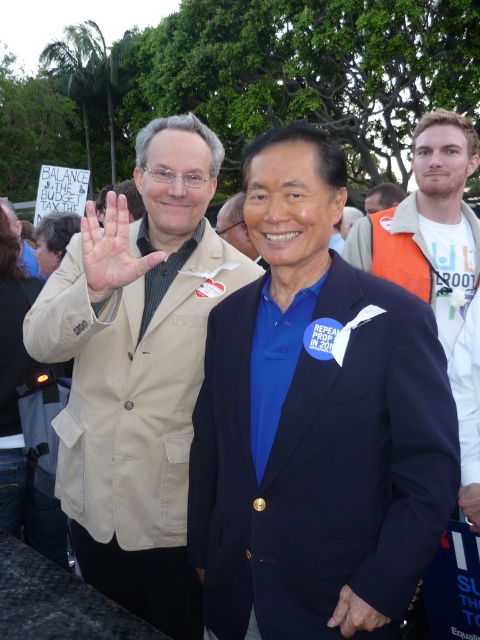
Can you confirm if matte black hair at lower left is positioned below matte black jacket at center?

Yes.

Where is `matte black hair at lower left`? The height and width of the screenshot is (640, 480). matte black hair at lower left is located at coordinates (54, 240).

Find the location of a particular element. The height and width of the screenshot is (640, 480). matte black hair at lower left is located at coordinates (54, 240).

Locate an element on the screen. The width and height of the screenshot is (480, 640). matte black hair at lower left is located at coordinates (54, 240).

Is navy wool blazer at center wider than matte black hair at lower left?

Correct, the width of navy wool blazer at center exceeds that of matte black hair at lower left.

Can you confirm if navy wool blazer at center is smaller than matte black hair at lower left?

No, navy wool blazer at center is not smaller than matte black hair at lower left.

At what (x,y) coordinates should I click in order to perform the action: click on navy wool blazer at center. Please return your answer as a coordinate pair (x, y). Looking at the image, I should click on (219, 448).

Is point (126, 330) closer to viewer compared to point (235, 420)?

No.

Based on the photo, between beige fabric jacket at left and navy wool blazer at center, which one is positioned higher?

Positioned higher is beige fabric jacket at left.

Locate an element on the screen. beige fabric jacket at left is located at coordinates (137, 371).